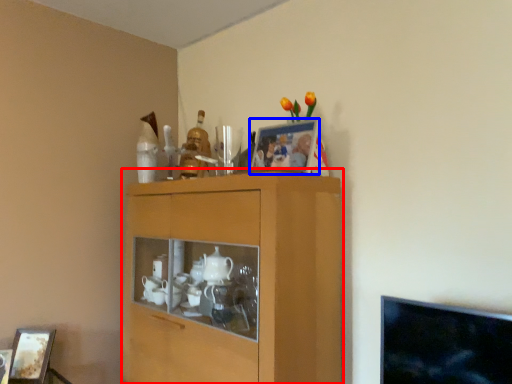
Question: Which point is further to the camera, cabinetry (highlighted by a red box) or picture frame (highlighted by a blue box)?

Choices:
 (A) cabinetry
 (B) picture frame

Answer: (B)